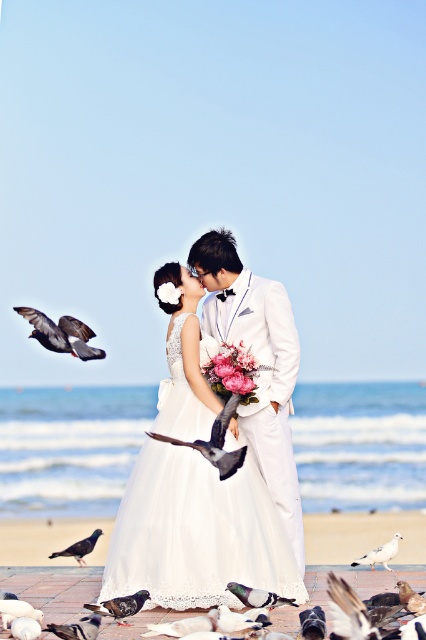
You are a photographer standing 25 meters away from the gray feathered pigeon at upper left. Can you take a clear photo of the pigeon without moving closer?

The gray feathered pigeon at upper left is 24.61 meters away from the viewer. Since you are standing 25 meters away, you are slightly further than the pigeon, so you might need to move closer for a clearer photo.

You are a photographer at the beach wedding scene. You want to capture a closeup of the couple without any pigeons in the frame. The pigeons are located at point [80,547]. Where should you position your camera to avoid the pigeons?

To avoid capturing the gray matte pigeon at lower left located at point [80,547], position the camera away from that coordinate. Focus on the couple while ensuring the camera frame does not include the area around point [80,547] where the pigeon is situated.